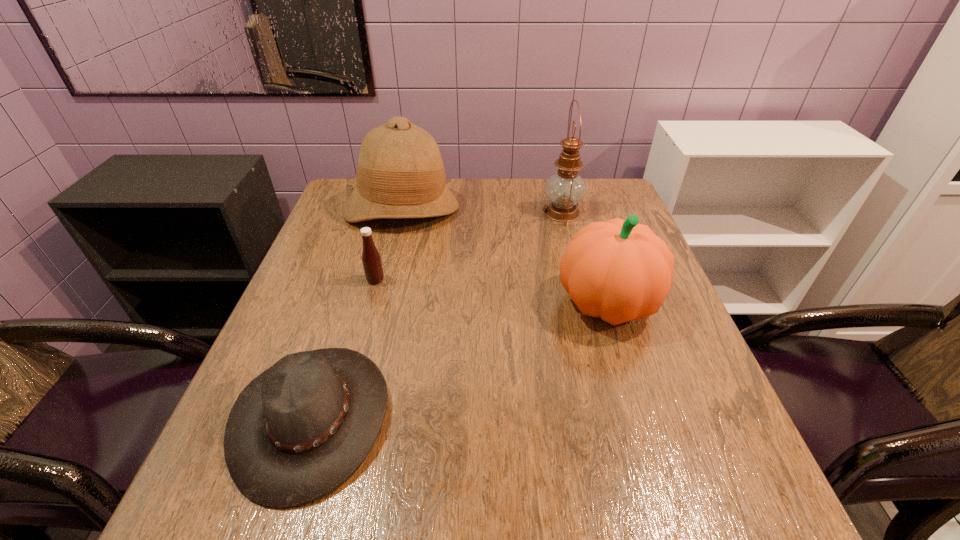
Find the location of `free space between the farther hat and the shorter hat`. free space between the farther hat and the shorter hat is located at coordinates (357, 313).

What are the coordinates of `object that is the closest to the pumpkin` in the screenshot? It's located at (565, 189).

Where is `object that is the second closest to the pumpkin`? This screenshot has width=960, height=540. object that is the second closest to the pumpkin is located at coordinates (400, 174).

Image resolution: width=960 pixels, height=540 pixels. What are the coordinates of `free space that satisfies the following two spatial constraints: 1. on the front-facing side of the farther hat; 2. on the left side of the oil lamp` in the screenshot? It's located at (400, 212).

Locate an element on the screen. The height and width of the screenshot is (540, 960). free point that satisfies the following two spatial constraints: 1. on the front side of the oil lamp; 2. on the left side of the pumpkin is located at coordinates (586, 302).